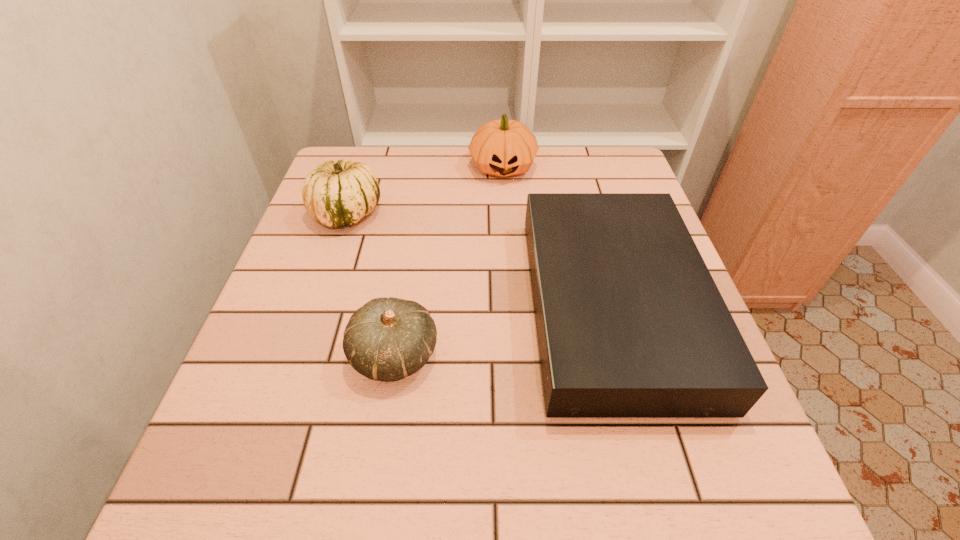
This screenshot has height=540, width=960. I want to click on the farthest gourd, so tap(503, 148).

Where is `the rightmost gourd`? The image size is (960, 540). the rightmost gourd is located at coordinates (503, 148).

At what (x,y) coordinates should I click in order to perform the action: click on the leftmost object. Please return your answer as a coordinate pair (x, y). Looking at the image, I should click on (336, 194).

At what (x,y) coordinates should I click in order to perform the action: click on the second nearest gourd. Please return your answer as a coordinate pair (x, y). The width and height of the screenshot is (960, 540). Looking at the image, I should click on (336, 194).

Where is `the second shortest object`? This screenshot has height=540, width=960. the second shortest object is located at coordinates (387, 339).

This screenshot has height=540, width=960. I want to click on the third object from right to left, so click(x=387, y=339).

This screenshot has width=960, height=540. In order to click on CD player in this screenshot , I will do (x=630, y=324).

Identify the location of vacant region located 0.060m on the side of the farthest object with the carved face. The image size is (960, 540). (505, 200).

What are the coordinates of `vacant space situated 0.110m on the front of the leftmost object` in the screenshot? It's located at pos(327,271).

The height and width of the screenshot is (540, 960). What are the coordinates of `blank space located 0.150m on the left of the shortest gourd` in the screenshot? It's located at (268, 355).